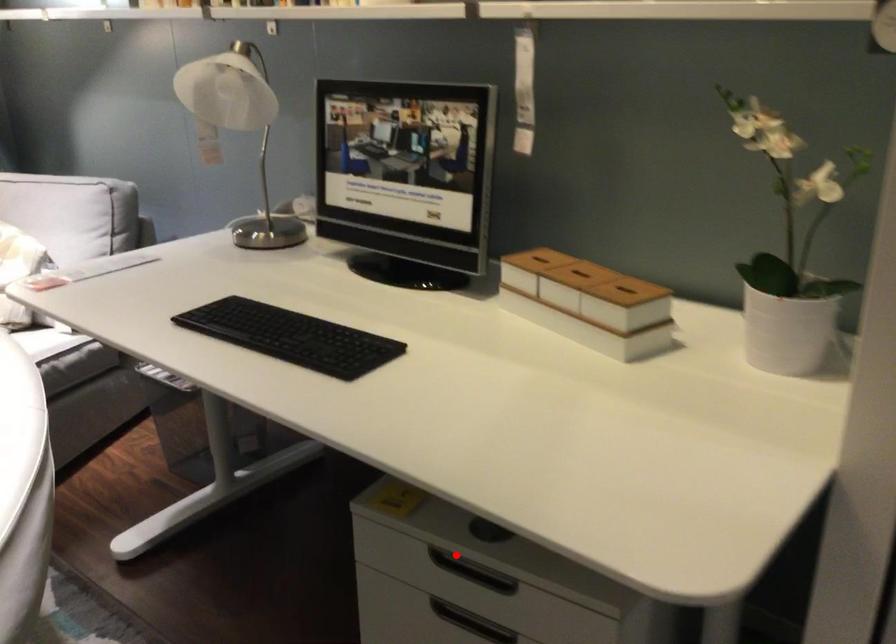
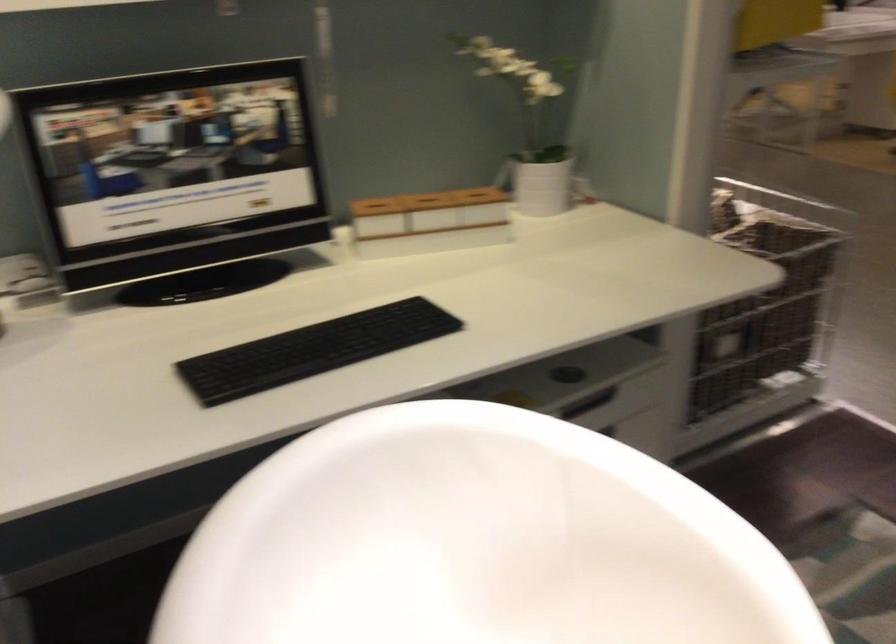
Question: I am providing you with two images of the same scene from different viewpoints. Image1 has a red point marked. In image2, the corresponding 3D location appears at what relative position? Reply with the corresponding letter.

Choices:
 (A) Closer
 (B) Farther

Answer: (B)